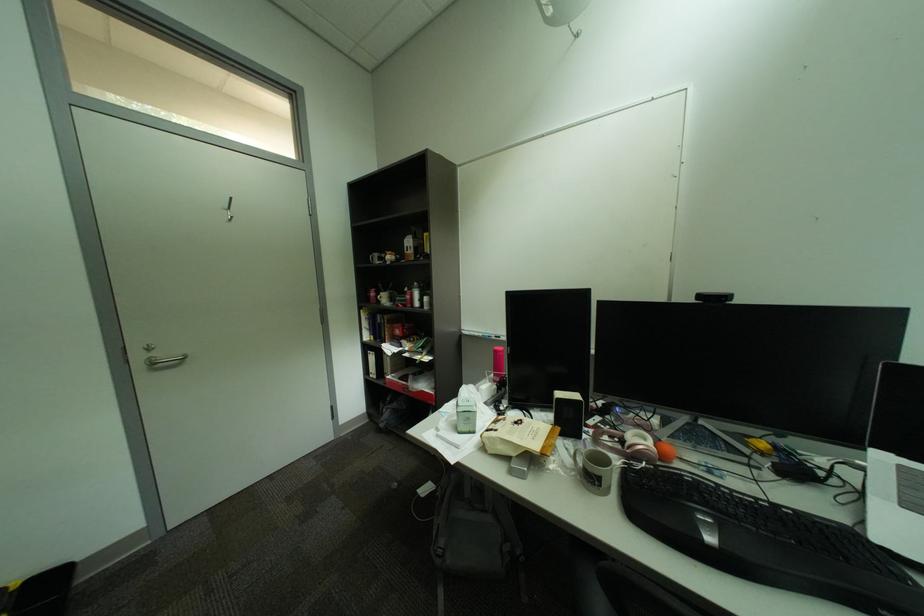
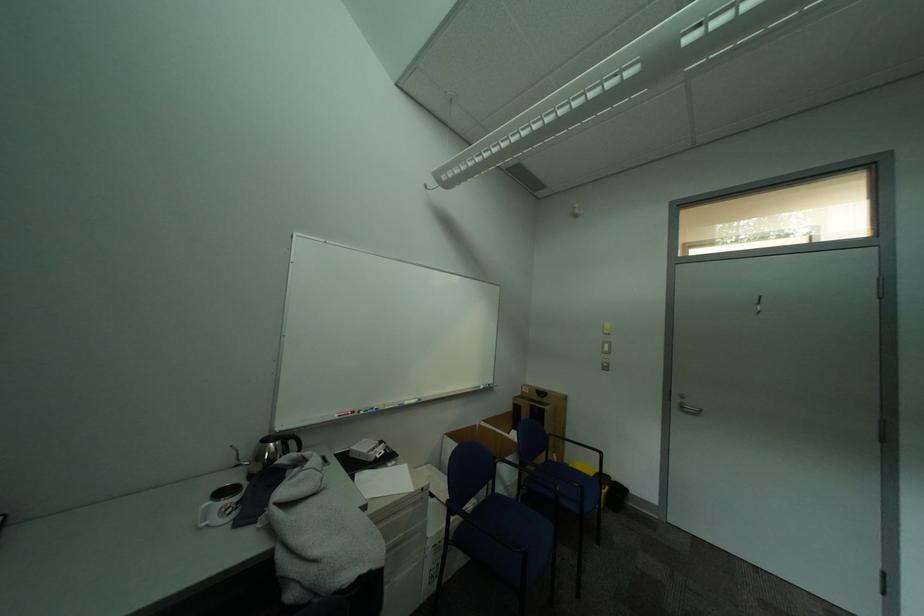
Question: The camera is either moving clockwise (left) or counter-clockwise (right) around the object. The first image is from the beginning of the video and the second image is from the end. Is the camera moving left or right when shooting the video?

Choices:
 (A) Left
 (B) Right

Answer: (B)